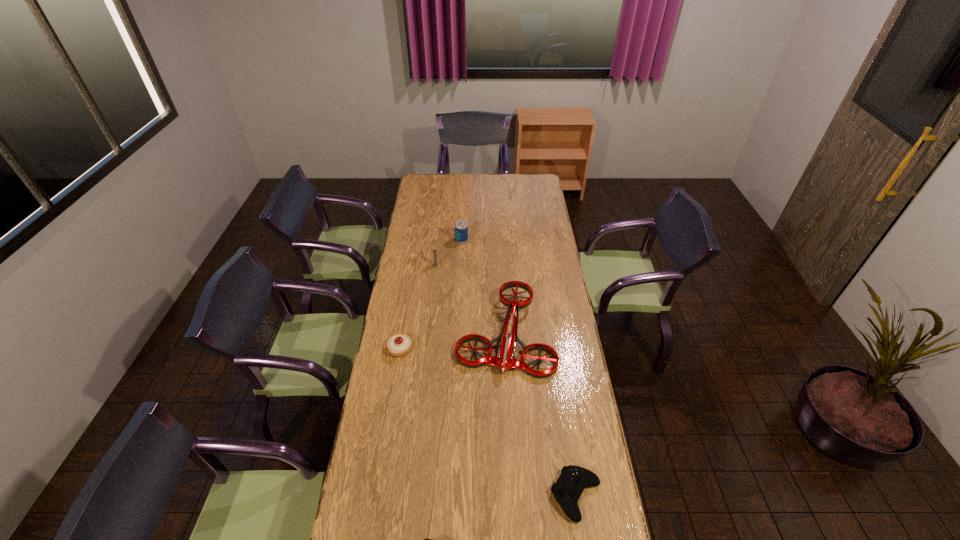
Image resolution: width=960 pixels, height=540 pixels. I want to click on the tallest object, so click(x=461, y=227).

At what (x,y) coordinates should I click in order to perform the action: click on the farthest object. Please return your answer as a coordinate pair (x, y). The height and width of the screenshot is (540, 960). Looking at the image, I should click on (461, 227).

I want to click on drone, so click(x=505, y=359).

You are a GUI agent. You are given a task and a screenshot of the screen. Output one action in this format:
    pyautogui.click(x=<x>, y=<y>)
    Task: Click on the igniter
    The image size is (960, 540).
    Given the screenshot: What is the action you would take?
    pyautogui.click(x=434, y=251)

You are a GUI agent. You are given a task and a screenshot of the screen. Output one action in this format:
    pyautogui.click(x=<x>, y=<y>)
    Task: Click on the second farthest object
    The width and height of the screenshot is (960, 540).
    Given the screenshot: What is the action you would take?
    pyautogui.click(x=434, y=251)

Locate an element on the screen. This screenshot has height=540, width=960. the leftmost object is located at coordinates (398, 345).

I want to click on pastry, so click(398, 345).

Locate an element on the screen. Image resolution: width=960 pixels, height=540 pixels. control is located at coordinates (568, 488).

I want to click on free spot located on the front of the beer can, so click(459, 296).

The width and height of the screenshot is (960, 540). I want to click on vacant area situated on the left of the drone, so click(x=427, y=332).